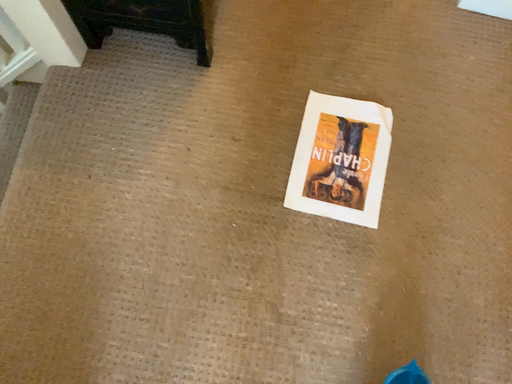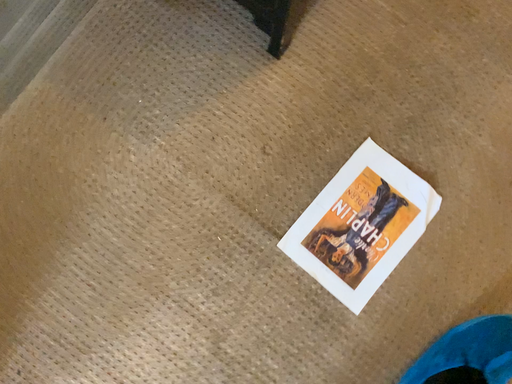
Question: How did the camera likely rotate when shooting the video?

Choices:
 (A) rotated downward
 (B) rotated upward

Answer: (A)